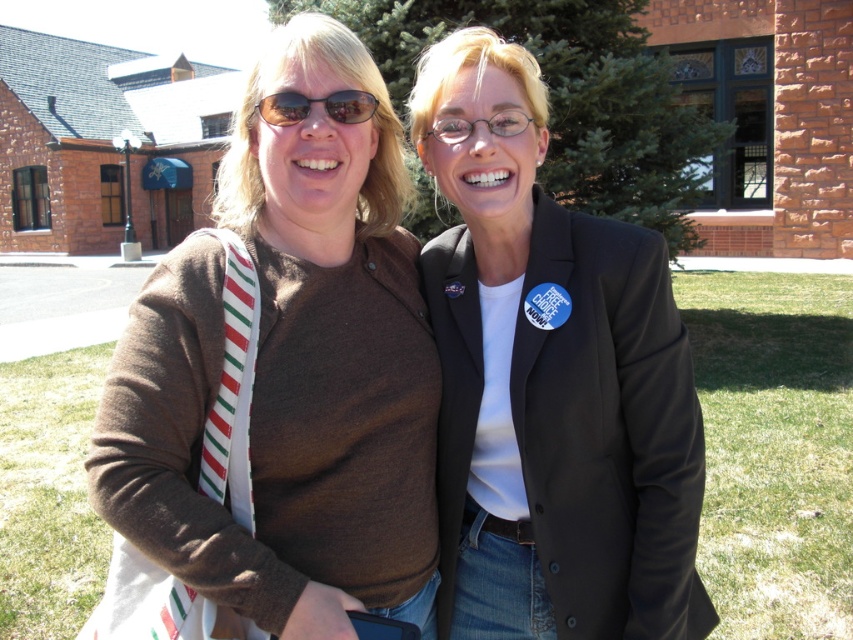
What do you see at coordinates (549, 381) in the screenshot? The height and width of the screenshot is (640, 853). I see `black matte blazer at center` at bounding box center [549, 381].

Between black matte blazer at center and white striped fabric tie at left, which one has less height?

With less height is white striped fabric tie at left.

Identify the location of black matte blazer at center. The image size is (853, 640). (549, 381).

The image size is (853, 640). Find the location of `black matte blazer at center`. black matte blazer at center is located at coordinates (549, 381).

Looking at this image, which is more to the left, white striped fabric tie at left or matte black sunglasses at center?

white striped fabric tie at left is more to the left.

How distant is white striped fabric tie at left from matte black sunglasses at center?

They are 17.91 inches apart.

Identify the location of white striped fabric tie at left. The image size is (853, 640). (231, 387).

Where is `white striped fabric tie at left`? white striped fabric tie at left is located at coordinates (231, 387).

Who is higher up, brown cotton sweater at center or black matte blazer at center?

brown cotton sweater at center is higher up.

Can you confirm if brown cotton sweater at center is positioned above black matte blazer at center?

Indeed, brown cotton sweater at center is positioned over black matte blazer at center.

The width and height of the screenshot is (853, 640). Identify the location of brown cotton sweater at center. (287, 371).

Where is `brown cotton sweater at center`? brown cotton sweater at center is located at coordinates (287, 371).